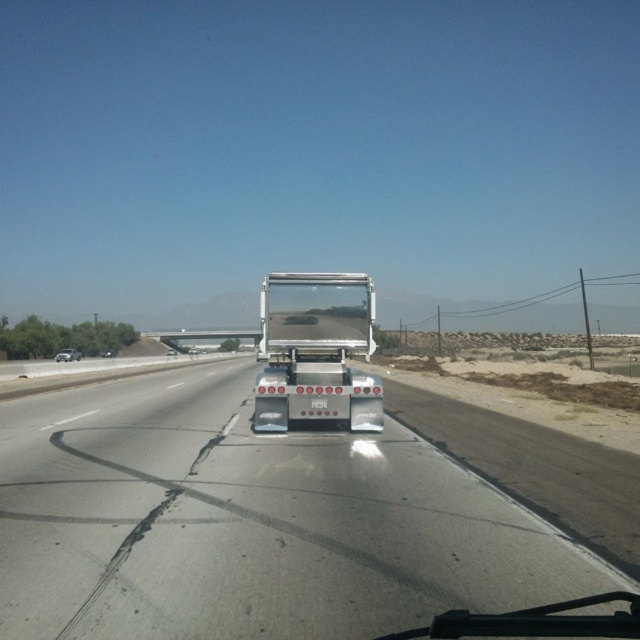
Question: Among these points, which one is nearest to the camera?

Choices:
 (A) (x=104, y=355)
 (B) (x=364, y=333)
 (C) (x=58, y=355)
 (D) (x=276, y=464)

Answer: (D)

Question: Which point is farther from the camera taking this photo?

Choices:
 (A) (540, 579)
 (B) (61, 358)

Answer: (B)

Question: Is silver metallic sedan at left bigger than silver metallic sedan at center?

Choices:
 (A) yes
 (B) no

Answer: (A)

Question: Does metallic silver truck at center have a greater width compared to transparent glass windshield at center?

Choices:
 (A) yes
 (B) no

Answer: (A)

Question: Which point is farther from the camera taking this photo?

Choices:
 (A) (108, 353)
 (B) (378, 445)
 (C) (378, 376)
 (D) (353, 300)

Answer: (A)

Question: From the image, what is the correct spatial relationship of metallic silver trailer truck at center in relation to transparent glass windshield at center?

Choices:
 (A) below
 (B) above

Answer: (A)